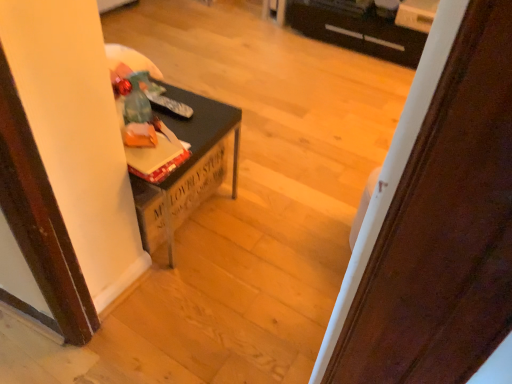
Where is `vacant area that lies between black plastic drawer at upper center and matte black table at left`? This screenshot has height=384, width=512. vacant area that lies between black plastic drawer at upper center and matte black table at left is located at coordinates (314, 93).